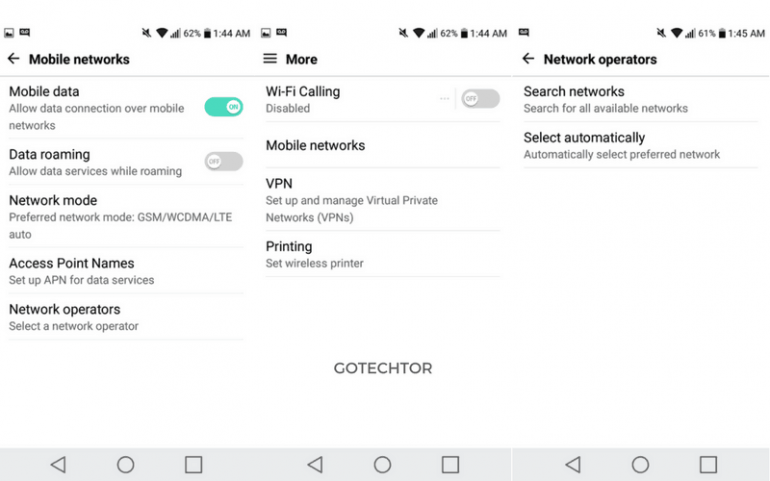
Locate an element on the screen. Image resolution: width=770 pixels, height=481 pixels. toggle switch on is located at coordinates (213, 108).